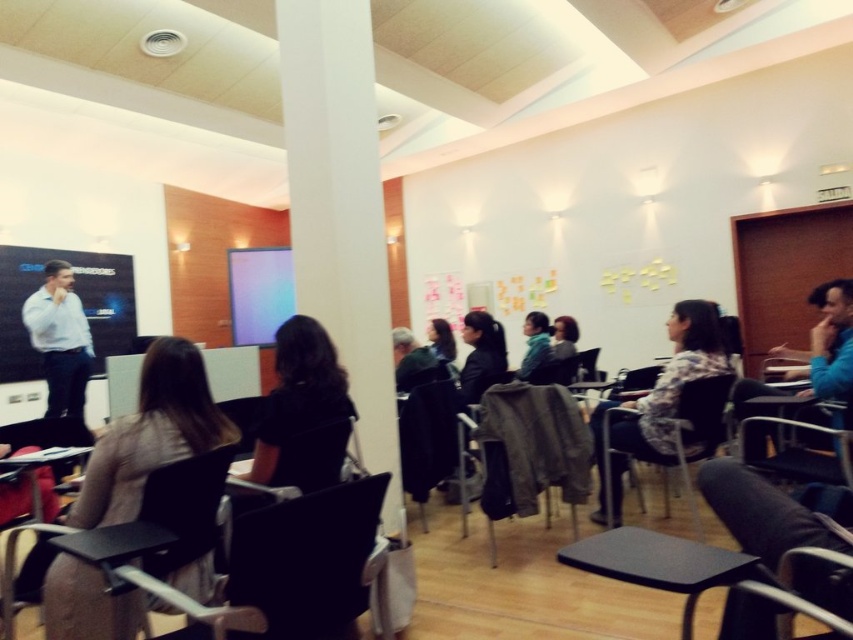
Question: Is black fabric jacket at center further to the viewer compared to metallic silver chair at lower right?

Choices:
 (A) yes
 (B) no

Answer: (A)

Question: Which point is farther to the camera?

Choices:
 (A) light blue denim jacket at center
 (B) blue fleece jacket at right
 (C) black leather chair at center

Answer: (A)

Question: Considering the real-world distances, which object is farthest from the wooden chair at center?

Choices:
 (A) black leather chair at center
 (B) metallic silver chair at lower right
 (C) matte black chair at center
 (D) dark gray fabric chair at center

Answer: (B)

Question: Does dark gray fabric chair at center come in front of matte black chair at center?

Choices:
 (A) yes
 (B) no

Answer: (B)

Question: Among these objects, which one is farthest from the camera?

Choices:
 (A) black plastic chair at lower center
 (B) matte black screen at left
 (C) gray fabric chair at center

Answer: (B)

Question: Does matte black screen at left have a larger size compared to dark gray fabric chair at center?

Choices:
 (A) no
 (B) yes

Answer: (B)